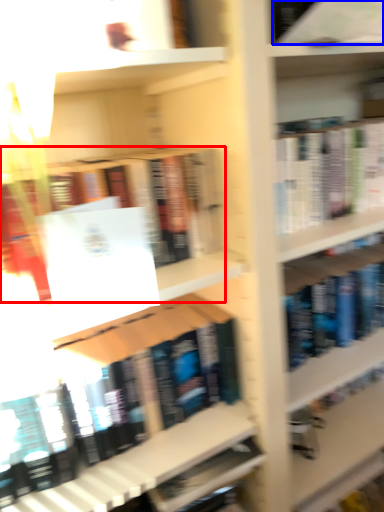
Question: Which object is further to the camera taking this photo, book (highlighted by a red box) or book (highlighted by a blue box)?

Choices:
 (A) book
 (B) book

Answer: (B)